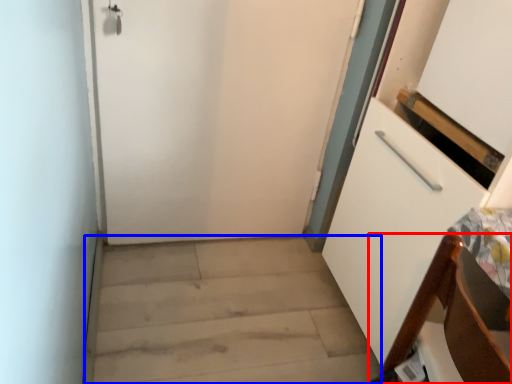
Question: Which of the following is the closest to the observer, furniture (highlighted by a red box) or stairwell (highlighted by a blue box)?

Choices:
 (A) furniture
 (B) stairwell

Answer: (A)